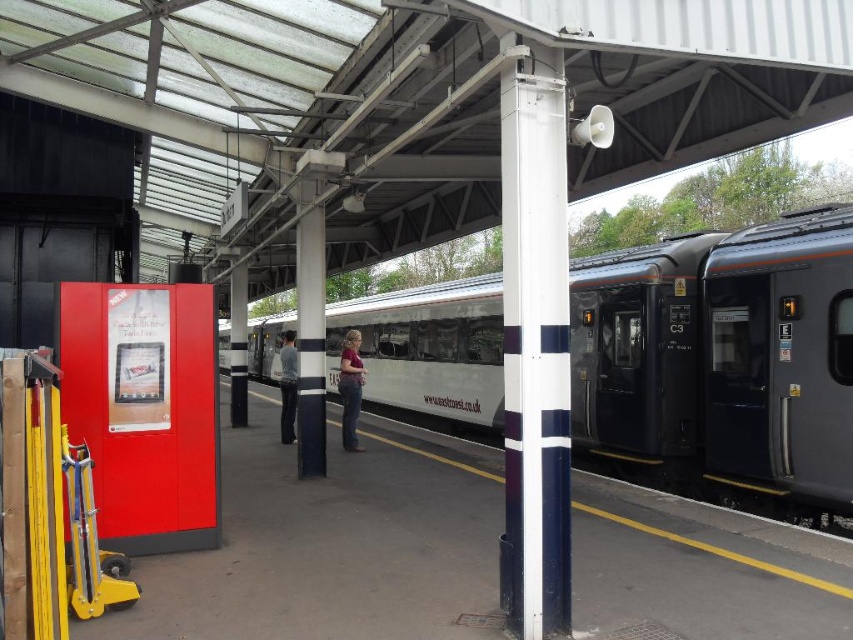
Question: Estimate the real-world distances between objects in this image. Which object is closer to the silver metallic train at center?

Choices:
 (A) white painted metal pole at center
 (B) dark gray jeans at center

Answer: (B)

Question: Does white painted metal pole at center come in front of matte pink shirt at center?

Choices:
 (A) yes
 (B) no

Answer: (A)

Question: Among these objects, which one is nearest to the camera?

Choices:
 (A) dark gray jeans at center
 (B) matte pink shirt at center
 (C) silver metallic train at center
 (D) white painted metal pole at center

Answer: (D)

Question: Estimate the real-world distances between objects in this image. Which object is farther from the dark gray jeans at center?

Choices:
 (A) silver metallic train at center
 (B) white painted metal pole at center

Answer: (B)

Question: Is matte pink shirt at center above dark gray jeans at center?

Choices:
 (A) no
 (B) yes

Answer: (B)

Question: Is white painted metal pole at center smaller than matte pink shirt at center?

Choices:
 (A) no
 (B) yes

Answer: (A)